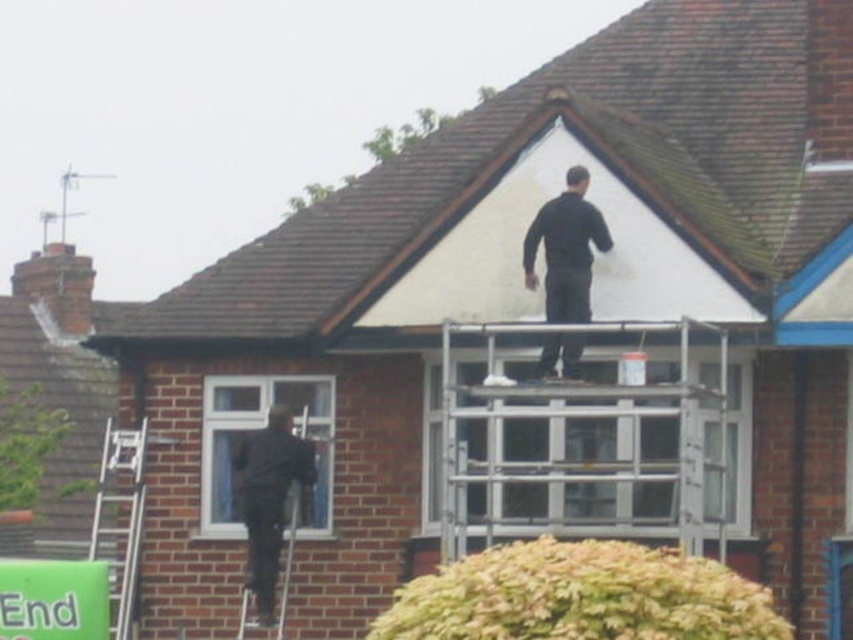
You are a contractor inspecting the roof of the house. You notice a black matte jacket at upper center. Based on its coordinates, can you determine if it is positioned closer to the edge of the roof or near the center?

The black matte jacket at upper center is located at point (566, 250), which places it closer to the center of the roof rather than the edge, as the coordinates are near the middle of the coordinate system.

You are a construction supervisor inspecting the roof of the house. You notice a point marked at coordinates (566, 250). Based on the scene description, where is this point located?

The point at (566, 250) is located on the black matte jacket at upper center.